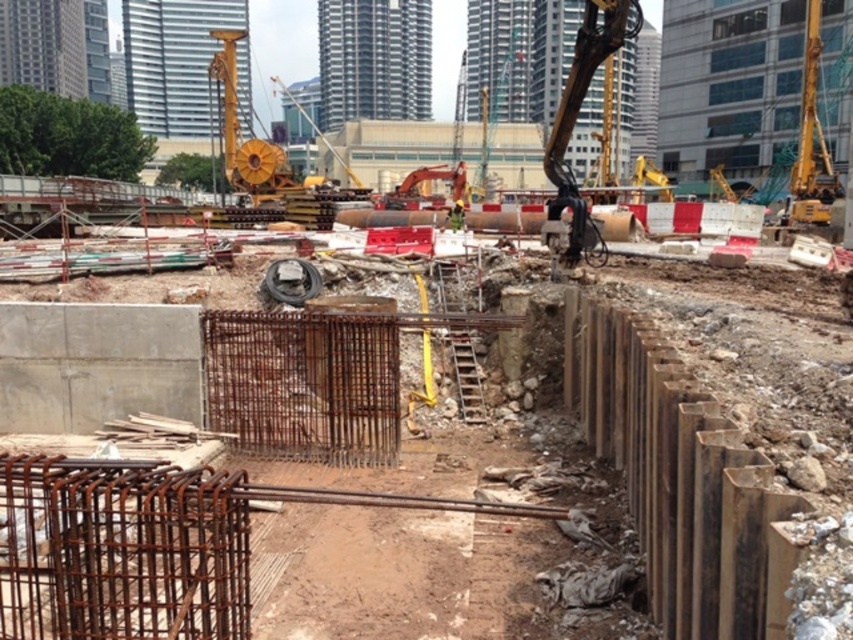
You are a construction worker standing at the camera position. You need to place a safety barrier that must be placed at least 4 meters away from the rusty metal rebar at center. Is the current distance sufficient?

The rusty metal rebar at center is 3.49 meters from the camera, which is less than the required 4 meters. Therefore, the safety barrier needs to be moved further away to comply with the safety distance requirement.

You are an engineer inspecting the construction site. You need to determine the position of the metallic arm at upper right relative to the center of the image. Is it closer to the top or the bottom edge of the image?

The metallic arm at upper right is located at point (573, 125), which means it is closer to the top edge of the image since the y coordinate is lower. In image coordinates, the origin is typically at the top left corner, so lower y values indicate positions closer to the top.